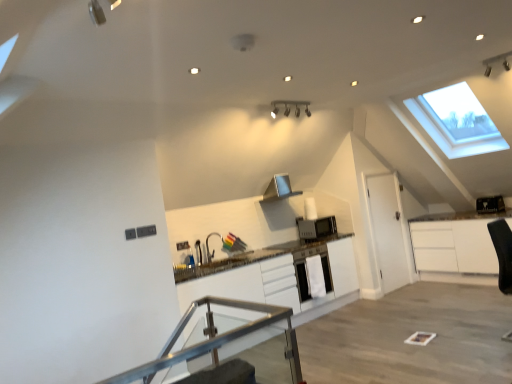
Describe the element at coordinates (490, 204) in the screenshot. I see `black plastic toaster at upper right, arranged as the first appliance when viewed from the right` at that location.

Describe the element at coordinates (389, 231) in the screenshot. I see `white matte door at right` at that location.

Identify the location of satin silver microwave at center, the 2th appliance viewed from the right. The height and width of the screenshot is (384, 512). (316, 227).

This screenshot has width=512, height=384. What do you see at coordinates (236, 330) in the screenshot? I see `transparent glass table at center` at bounding box center [236, 330].

Describe the element at coordinates (279, 276) in the screenshot. Image resolution: width=512 pixels, height=384 pixels. I see `white matte cabinet at center` at that location.

The image size is (512, 384). Describe the element at coordinates (502, 253) in the screenshot. I see `black leather swivel chair at lower right` at that location.

Where is `black plastic toaster at upper right, acting as the 2th appliance starting from the bottom`? black plastic toaster at upper right, acting as the 2th appliance starting from the bottom is located at coordinates (490, 204).

From a real-world perspective, which object stands above the other?

black plastic toaster at upper right, acting as the 2th appliance starting from the bottom, from a real-world perspective.

Which object is further away from the camera, black leather swivel chair at lower right or black plastic toaster at upper right, arranged as the first appliance when viewed from the right?

Positioned behind is black plastic toaster at upper right, arranged as the first appliance when viewed from the right.

From a real-world perspective, starting from the black leather swivel chair at lower right, which appliance is the 1st one vertically above it? Please provide its 2D coordinates.

[(490, 204)]

Can you confirm if white matte door at right is taller than transparent glass table at center?

Indeed, white matte door at right has a greater height compared to transparent glass table at center.

The width and height of the screenshot is (512, 384). In order to click on table that is on the left side of white matte door at right in this screenshot , I will do `click(236, 330)`.

Considering the positions of point (373, 199) and point (214, 331), is point (373, 199) closer or farther from the camera than point (214, 331)?

Point (373, 199) is farther from the camera than point (214, 331).

Measure the distance from satin silver microwave at center, placed as the 1th appliance when sorted from bottom to top, to transparent glass table at center.

satin silver microwave at center, placed as the 1th appliance when sorted from bottom to top, is 9.78 feet away from transparent glass table at center.

Do you think satin silver microwave at center, placed as the 1th appliance when sorted from bottom to top, is within transparent glass table at center, or outside of it?

satin silver microwave at center, placed as the 1th appliance when sorted from bottom to top, cannot be found inside transparent glass table at center.

Between satin silver microwave at center, the 1th appliance positioned from the left, and transparent glass table at center, which one is positioned in front?

transparent glass table at center is more forward.

Consider the image. Would you consider satin silver microwave at center, the 2th appliance viewed from the right, to be distant from transparent glass table at center?

Yes, satin silver microwave at center, the 2th appliance viewed from the right, is far from transparent glass table at center.

Considering the relative positions of white matte dishwasher at center and silver metallic exhaust hood at center in the image provided, is white matte dishwasher at center to the left of silver metallic exhaust hood at center from the viewer's perspective?

No, white matte dishwasher at center is not to the left of silver metallic exhaust hood at center.

At what (x,y) coordinates should I click in order to perform the action: click on exhaust hood above the white matte dishwasher at center (from a real-world perspective). Please return your answer as a coordinate pair (x, y). Looking at the image, I should click on tap(279, 188).

Is satin silver microwave at center, which is the second appliance from top to bottom, to the right of black plastic toaster at upper right, acting as the 2th appliance starting from the bottom, from the viewer's perspective?

No, satin silver microwave at center, which is the second appliance from top to bottom, is not to the right of black plastic toaster at upper right, acting as the 2th appliance starting from the bottom.

Which of these two, satin silver microwave at center, the 2th appliance viewed from the right, or black plastic toaster at upper right, acting as the 2th appliance starting from the bottom, is bigger?

satin silver microwave at center, the 2th appliance viewed from the right, is bigger.

This screenshot has height=384, width=512. What are the coordinates of `dish washer below the satin silver microwave at center, which is the second appliance from top to bottom (from the image's perspective)` in the screenshot? It's located at (305, 269).

In the scene shown: Which point is more distant from viewer, (305, 269) or (328, 234)?

The point (328, 234) is behind.

Considering the sizes of objects white matte dishwasher at center and satin silver microwave at center, placed as the 1th appliance when sorted from bottom to top, in the image provided, who is smaller, white matte dishwasher at center or satin silver microwave at center, placed as the 1th appliance when sorted from bottom to top,?

white matte dishwasher at center.

Based on the photo, measure the distance between transparent glass table at center and white matte door at right.

The distance of transparent glass table at center from white matte door at right is 3.52 meters.

From a real-world perspective, which is physically above, transparent glass table at center or white matte door at right?

From a 3D spatial view, white matte door at right is above.

Considering the sizes of transparent glass table at center and white matte door at right in the image, is transparent glass table at center bigger or smaller than white matte door at right?

Considering their sizes, transparent glass table at center takes up less space than white matte door at right.

Between transparent glass table at center and white matte door at right, which one appears on the left side from the viewer's perspective?

From the viewer's perspective, transparent glass table at center appears more on the left side.

I want to click on appliance on the right of black leather swivel chair at lower right, so click(x=490, y=204).

In the image, there is a transparent glass table at center. What are the coordinates of `door above it (from the image's perspective)` in the screenshot? It's located at (389, 231).

Which object lies nearer to the anchor point black plastic toaster at upper right, acting as the 2th appliance starting from the bottom, white matte door at right or satin silver microwave at center, the 2th appliance viewed from the right?

white matte door at right is closer to black plastic toaster at upper right, acting as the 2th appliance starting from the bottom.

Estimate the real-world distances between objects in this image. Which object is closer to silver metallic exhaust hood at center, black plastic toaster at upper right, which appears as the 1th appliance when viewed from the top, or black leather swivel chair at lower right?

black leather swivel chair at lower right.

Looking at the image, which one is located further to black leather swivel chair at lower right, transparent glass table at center or satin silver microwave at center, placed as the 1th appliance when sorted from bottom to top?

Among the two, transparent glass table at center is located further to black leather swivel chair at lower right.

From the picture: From the image, which object appears to be farther from satin silver microwave at center, the 1th appliance positioned from the left, black leather swivel chair at lower right or white matte dishwasher at center?

black leather swivel chair at lower right.

Considering their positions, is white matte door at right positioned further to satin silver microwave at center, placed as the 1th appliance when sorted from bottom to top, than silver metallic exhaust hood at center?

white matte door at right.

From the image, which object appears to be farther from satin silver microwave at center, which is the second appliance from top to bottom, white matte door at right or white matte cabinet at center?

white matte door at right lies further to satin silver microwave at center, which is the second appliance from top to bottom, than the other object.

Looking at the image, which one is located further to white matte dishwasher at center, transparent glass table at center or white matte door at right?

Based on the image, transparent glass table at center appears to be further to white matte dishwasher at center.

Looking at the image, which one is located closer to silver metallic exhaust hood at center, white matte dishwasher at center or white matte door at right?

white matte dishwasher at center is positioned closer to the anchor silver metallic exhaust hood at center.

You are a GUI agent. You are given a task and a screenshot of the screen. Output one action in this format:
    pyautogui.click(x=<x>, y=<y>)
    Task: Click on the dish washer between black leather swivel chair at lower right and satin silver microwave at center, the 2th appliance viewed from the right, along the z-axis
    
    Given the screenshot: What is the action you would take?
    pyautogui.click(x=305, y=269)

Find the location of `cabinetry between black leather swivel chair at lower right and satin silver microwave at center, which is the second appliance from top to bottom, along the z-axis`. cabinetry between black leather swivel chair at lower right and satin silver microwave at center, which is the second appliance from top to bottom, along the z-axis is located at coordinates [279, 276].

You are a GUI agent. You are given a task and a screenshot of the screen. Output one action in this format:
    pyautogui.click(x=<x>, y=<y>)
    Task: Click on the dish washer situated between white matte cabinet at center and black leather swivel chair at lower right from left to right
    
    Given the screenshot: What is the action you would take?
    (x=305, y=269)

Locate an element on the screen. This screenshot has height=384, width=512. appliance located between transparent glass table at center and satin silver microwave at center, placed as the 1th appliance when sorted from bottom to top, in the depth direction is located at coordinates (490, 204).